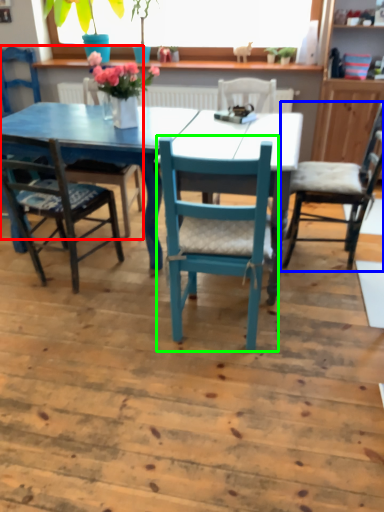
Question: Which object is the closest to the chair (highlighted by a red box)? Choose among these: chair (highlighted by a blue box) or chair (highlighted by a green box).

Choices:
 (A) chair
 (B) chair

Answer: (B)